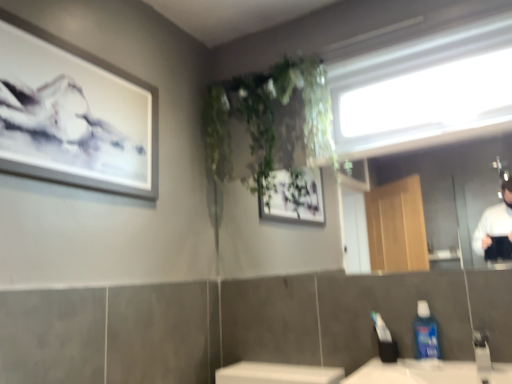
Locate an element on the screen. This screenshot has height=384, width=512. vacant point above clear glass mirror at upper center (from a real-world perspective) is located at coordinates (389, 146).